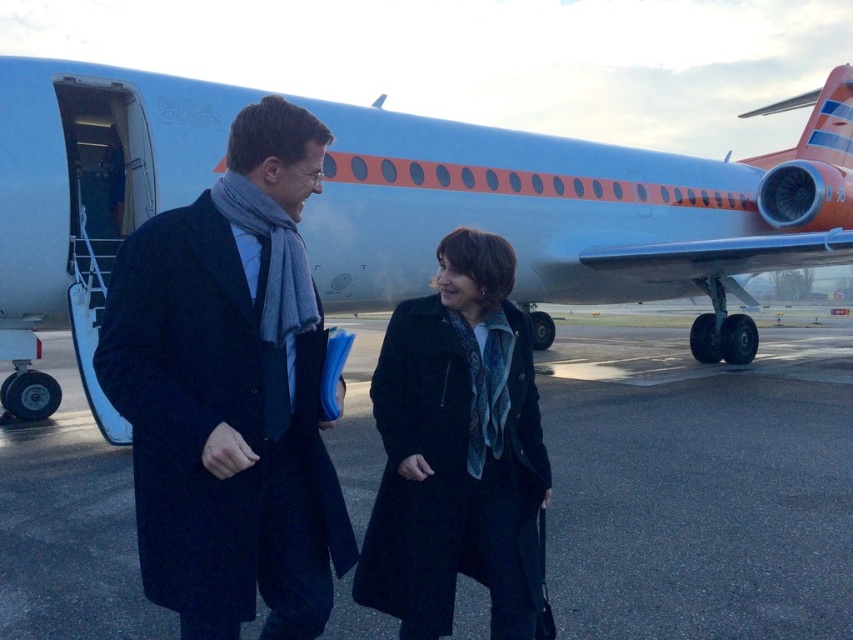
Question: Which point is farther to the camera?

Choices:
 (A) (53, 445)
 (B) (219, 410)
 (C) (445, 237)
 (D) (364, 163)

Answer: (D)

Question: Which of these objects is positioned closest to the black asphalt at center?

Choices:
 (A) dark blue wool coat at center
 (B) blue matte airplane at center

Answer: (B)

Question: Which object is the closest to the black asphalt at center?

Choices:
 (A) blue matte airplane at center
 (B) dark blue wool coat at center

Answer: (A)

Question: Is blue matte airplane at center thinner than black asphalt at center?

Choices:
 (A) yes
 (B) no

Answer: (A)

Question: Considering the relative positions of blue matte airplane at center and black wool coat at center in the image provided, where is blue matte airplane at center located with respect to black wool coat at center?

Choices:
 (A) below
 (B) above

Answer: (B)

Question: Can you confirm if blue matte airplane at center is thinner than black wool coat at center?

Choices:
 (A) yes
 (B) no

Answer: (B)